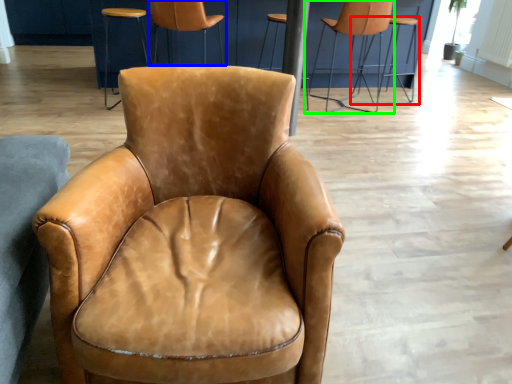
Question: Based on their relative distances, which object is nearer to chair (highlighted by a red box)? Choose from chair (highlighted by a blue box) and chair (highlighted by a green box).

Choices:
 (A) chair
 (B) chair

Answer: (B)